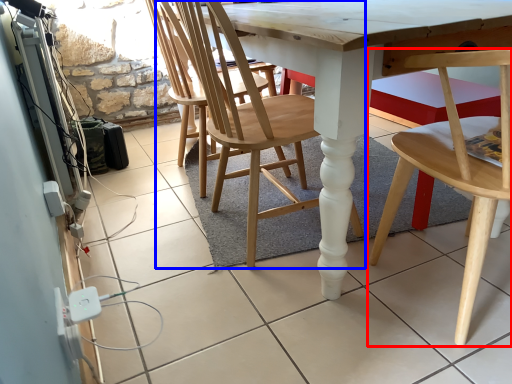
Question: Among these objects, which one is nearest to the camera, chair (highlighted by a red box) or chair (highlighted by a blue box)?

Choices:
 (A) chair
 (B) chair

Answer: (A)